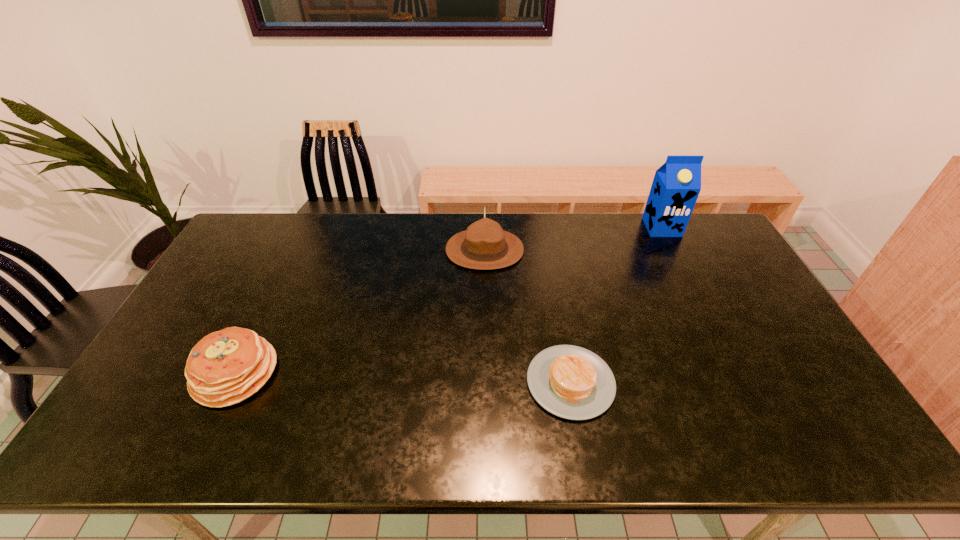
Where is `free space between the taller pancake and the shorter pancake`? The width and height of the screenshot is (960, 540). free space between the taller pancake and the shorter pancake is located at coordinates (403, 377).

Identify the location of empty space that is in between the shorter pancake and the carton. (616, 305).

The image size is (960, 540). Find the location of `unoccupied position between the right pancake and the tallest object`. unoccupied position between the right pancake and the tallest object is located at coordinates (616, 305).

The image size is (960, 540). What are the coordinates of `vacant space that's between the shorter pancake and the tallest object` in the screenshot? It's located at (x=616, y=305).

Locate which object ranks in proximity to the fedora. Please provide its 2D coordinates. Your answer should be formatted as a tuple, i.e. [(x, y)], where the tuple contains the x and y coordinates of a point satisfying the conditions above.

[(571, 382)]

Identify the location of the third closest object relative to the fedora. (225, 367).

You are a GUI agent. You are given a task and a screenshot of the screen. Output one action in this format:
    pyautogui.click(x=<x>, y=<y>)
    Task: Click on the free point that satisfies the following two spatial constraints: 1. on the back side of the right pancake; 2. on the feather side of the fedora
    The height and width of the screenshot is (540, 960).
    Given the screenshot: What is the action you would take?
    pos(547,250)

The height and width of the screenshot is (540, 960). Find the location of `vacant space that satisfies the following two spatial constraints: 1. on the feather side of the fedora; 2. on the left side of the shortest object`. vacant space that satisfies the following two spatial constraints: 1. on the feather side of the fedora; 2. on the left side of the shortest object is located at coordinates (487, 382).

Find the location of a particular element. The width and height of the screenshot is (960, 540). vacant area that satisfies the following two spatial constraints: 1. with the cap open on the carton; 2. on the feather side of the fedora is located at coordinates (673, 250).

The width and height of the screenshot is (960, 540). Find the location of `free space that satisfies the following two spatial constraints: 1. on the back side of the right pancake; 2. on the feather side of the fedora`. free space that satisfies the following two spatial constraints: 1. on the back side of the right pancake; 2. on the feather side of the fedora is located at coordinates (547, 250).